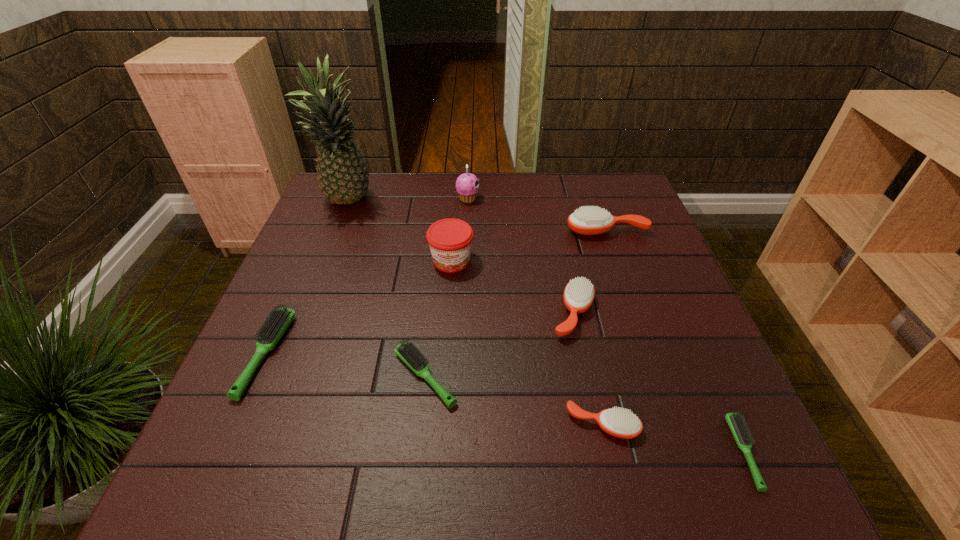
Where is `green pineapple`? The width and height of the screenshot is (960, 540). green pineapple is located at coordinates (343, 177).

Identify the location of the tallest object. (343, 177).

Find the location of a particular element. the second tallest object is located at coordinates (467, 185).

Where is `the seventh shortest object`? The width and height of the screenshot is (960, 540). the seventh shortest object is located at coordinates (450, 240).

Where is `red jam`? red jam is located at coordinates (450, 240).

This screenshot has width=960, height=540. Identify the location of the fourth tallest object. (593, 220).

Find the location of a particular element. the tallest hairbrush is located at coordinates (593, 220).

The image size is (960, 540). Identify the location of the fifth shortest object. 579,294.

Find the location of a particular element. the second nearest orange hairbrush is located at coordinates (579, 294).

The height and width of the screenshot is (540, 960). Identify the location of the leftmost hairbrush. (276, 324).